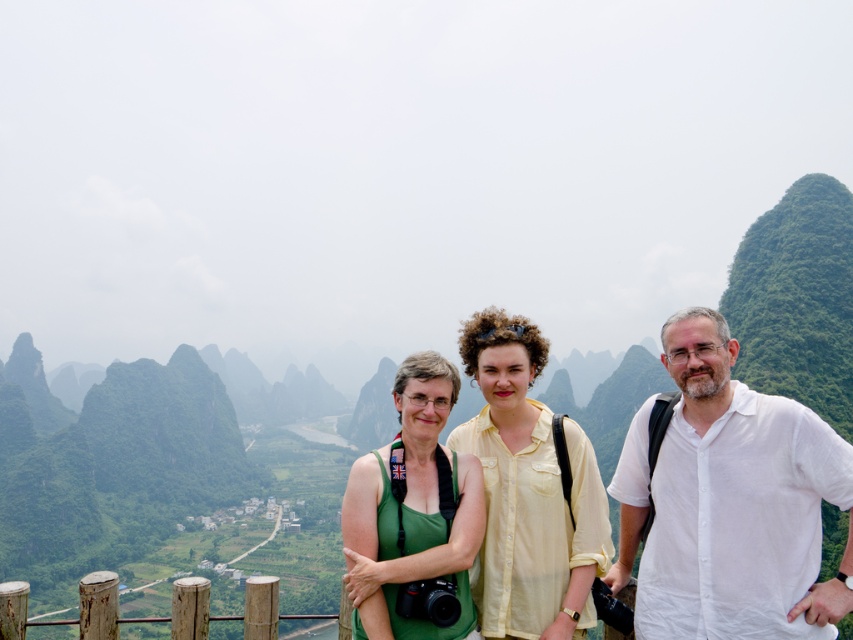
Question: Which point appears farthest from the camera in this image?

Choices:
 (A) (508, 538)
 (B) (416, 385)

Answer: (B)

Question: Which point is closer to the camera?

Choices:
 (A) yellow matte shirt at center
 (B) white cotton shirt at right
 (C) brown wood fence at lower left
 (D) green fabric tank top at center

Answer: (B)

Question: Does white cotton shirt at right have a smaller size compared to yellow matte shirt at center?

Choices:
 (A) yes
 (B) no

Answer: (A)

Question: From the image, what is the correct spatial relationship of yellow matte shirt at center in relation to green fabric tank top at center?

Choices:
 (A) right
 (B) left

Answer: (A)

Question: Is yellow matte shirt at center positioned at the back of brown wood fence at lower left?

Choices:
 (A) yes
 (B) no

Answer: (B)

Question: Which of the following is the closest to the observer?

Choices:
 (A) pos(851,461)
 (B) pos(413,378)

Answer: (A)